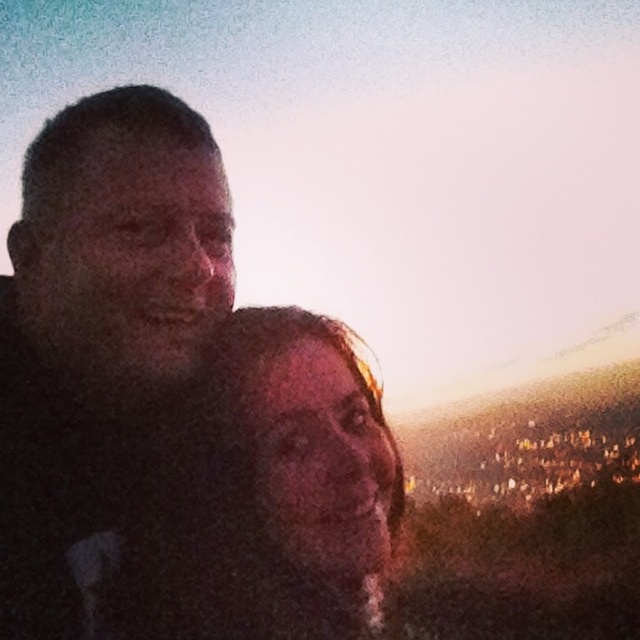
Does dark matte face at left have a lesser height compared to matte skin tone face at center?

Incorrect, dark matte face at left's height does not fall short of matte skin tone face at center's.

Does dark matte face at left appear on the right side of matte skin tone face at center?

In fact, dark matte face at left is to the left of matte skin tone face at center.

Which is behind, point (220, 198) or point (332, 474)?

The point (220, 198) is behind.

Image resolution: width=640 pixels, height=640 pixels. What are the coordinates of `dark matte face at left` in the screenshot? It's located at (97, 316).